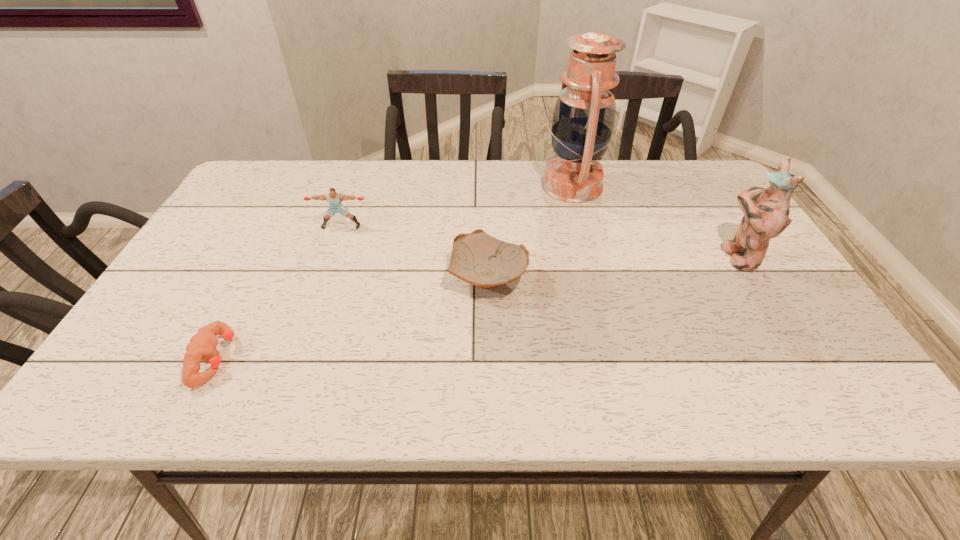
Where is `object present at the right edge`? This screenshot has height=540, width=960. object present at the right edge is located at coordinates (766, 210).

You are a GUI agent. You are given a task and a screenshot of the screen. Output one action in this format:
    pyautogui.click(x=<x>, y=<y>)
    Task: Click on the object present at the near left corner
    The width and height of the screenshot is (960, 540).
    Given the screenshot: What is the action you would take?
    pyautogui.click(x=202, y=346)

I want to click on free region at the far edge of the desktop, so click(x=467, y=160).

In the image, there is a desktop. Where is `free space at the near edge`? free space at the near edge is located at coordinates (398, 396).

The height and width of the screenshot is (540, 960). Identify the location of free space at the left edge of the desktop. (210, 299).

You are a GUI agent. You are given a task and a screenshot of the screen. Output one action in this format:
    pyautogui.click(x=<x>, y=<y>)
    Task: Click on the vacant position at the right edge of the desktop
    Image resolution: width=960 pixels, height=540 pixels.
    Given the screenshot: What is the action you would take?
    pyautogui.click(x=837, y=352)

Identify the location of vacant space at the far left corner of the desktop. (249, 199).

Locate an element on the screen. This screenshot has height=540, width=960. vacant area at the near left corner of the desktop is located at coordinates (129, 379).

I want to click on free space at the far right corner, so click(x=692, y=168).

What are the coordinates of `blank space at the near right corner of the desktop` in the screenshot? It's located at (868, 398).